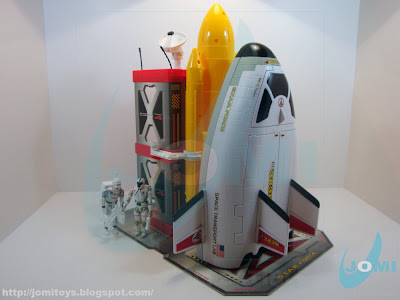
The image size is (400, 300). I want to click on white surface, so click(73, 257).